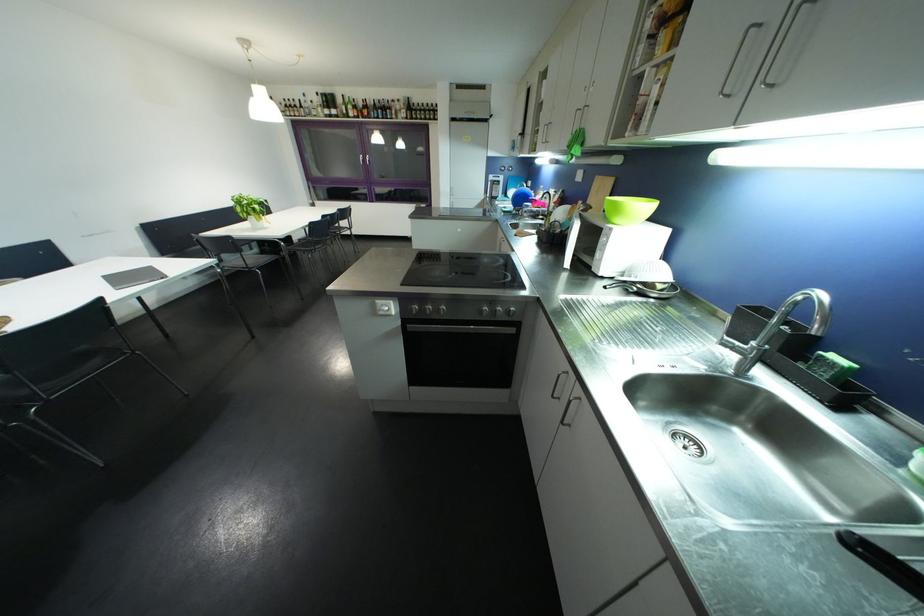
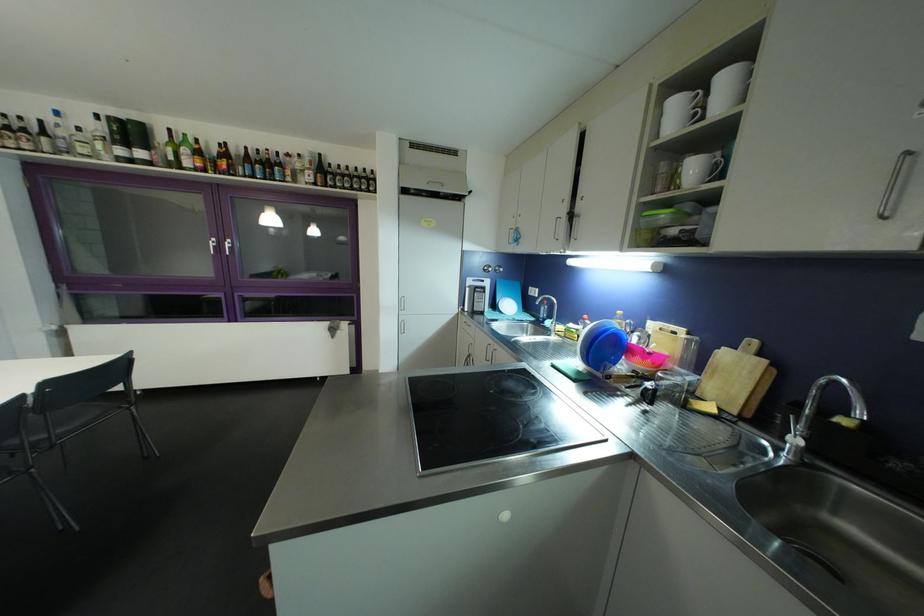
The point at (346, 103) is marked in the first image. Where is the corresponding point in the second image?

(167, 140)